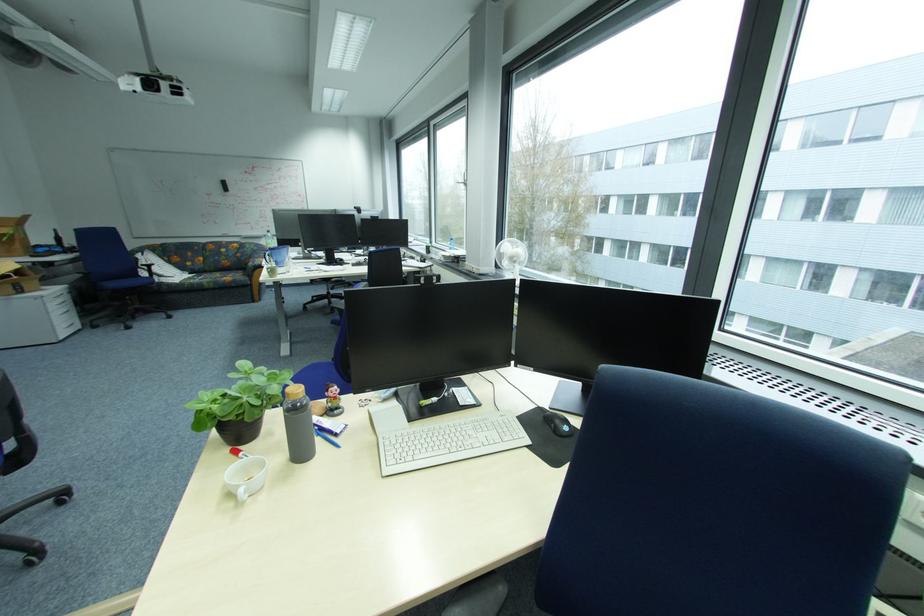
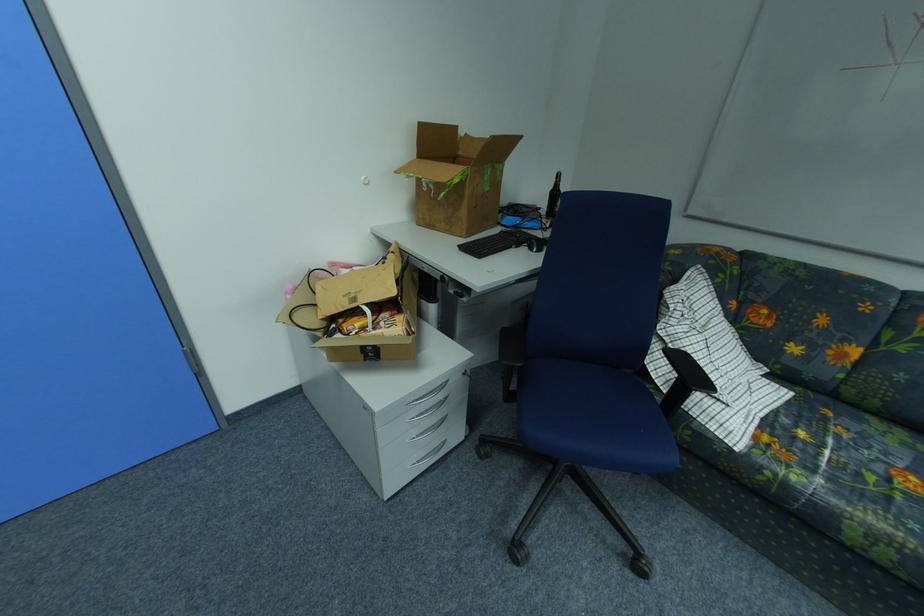
Find the pixel in the second image that matches (x=63, y=237) in the first image.

(560, 188)